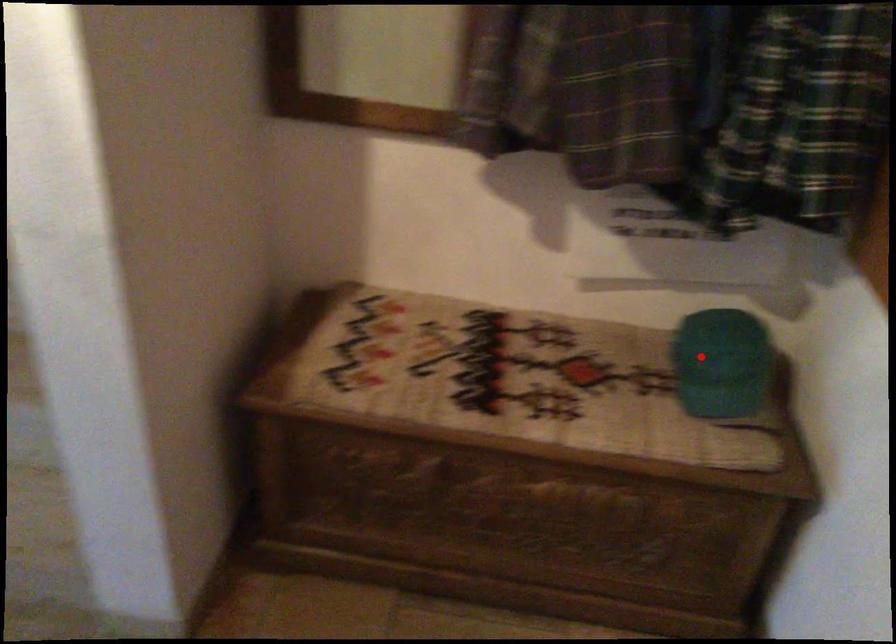
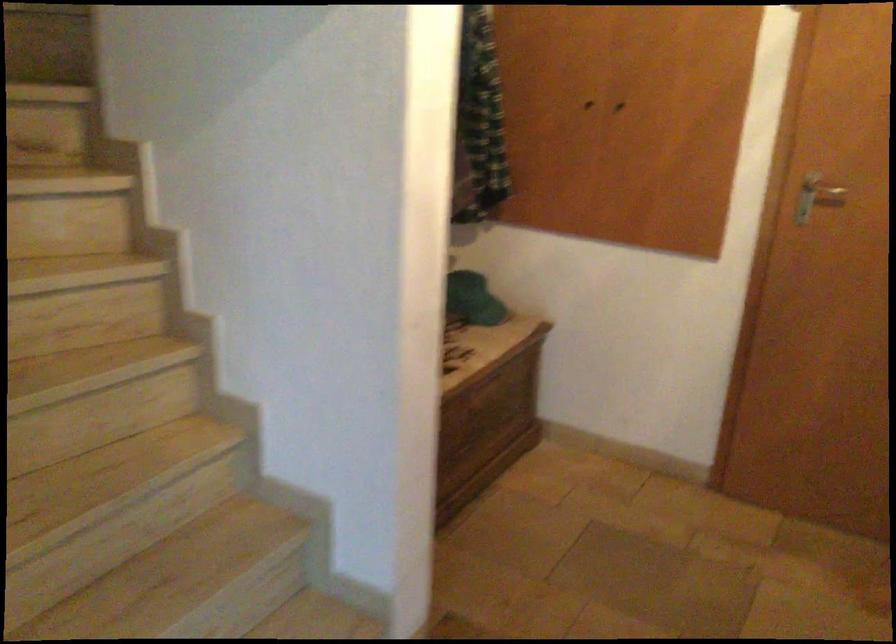
Question: I am providing you with two images of the same scene from different viewpoints. Image1 has a red point marked. In image2, the corresponding 3D location appears at what relative position? Reply with the corresponding letter.

Choices:
 (A) Closer
 (B) Farther

Answer: (B)